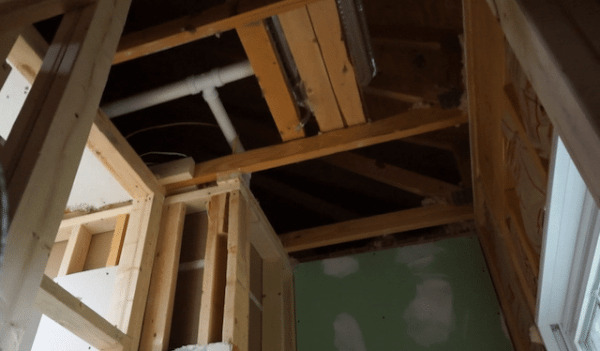
At what (x,y) coordinates should I click in order to perform the action: click on attic. Please return your answer as a coordinate pair (x, y). The width and height of the screenshot is (600, 351). Looking at the image, I should click on (302, 193).